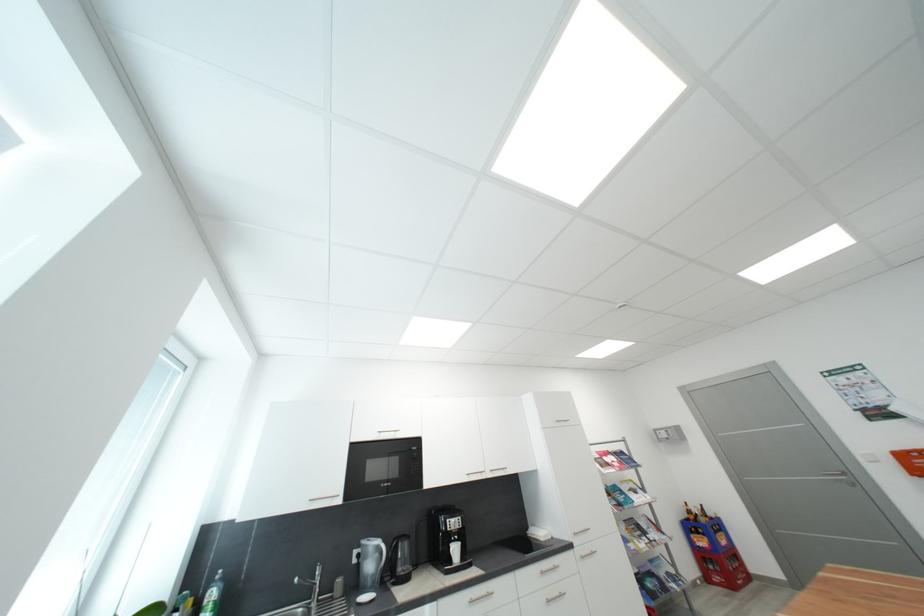
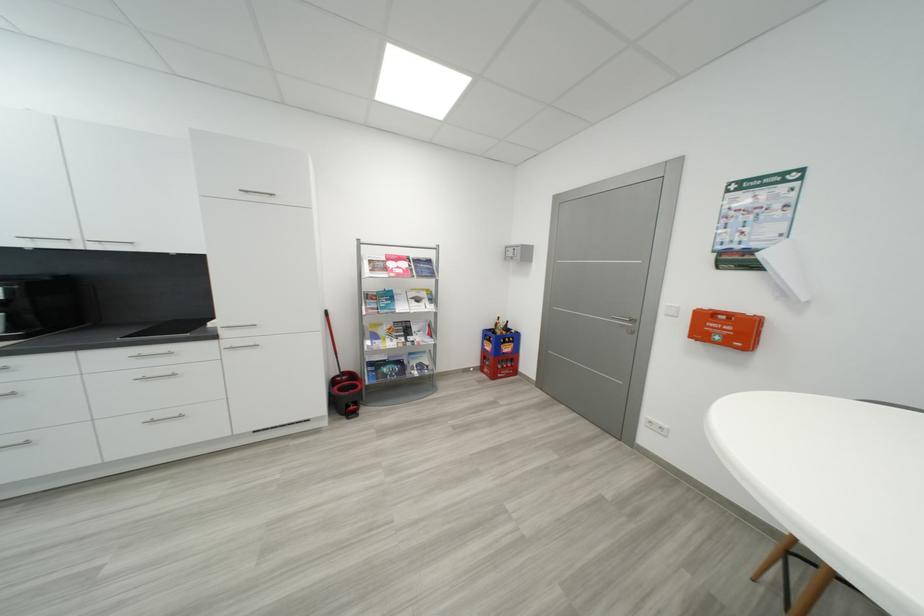
The point at [614,466] is marked in the first image. Where is the corresponding point in the second image?

(393, 270)